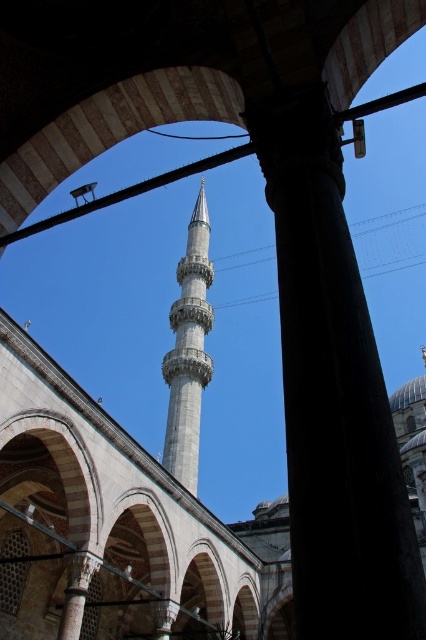
You are standing inside the mosque and want to take a photo of the smooth white minaret at center. To avoid blocking the minaret in your photo, which direction should you move relative to the smooth stone pillar at center?

You should move to the left relative to the smooth stone pillar at center because the smooth stone pillar at center is to the right of the smooth white minaret at center, so moving left would position you away from the pillar and keep the minaret unobstructed.

You are standing inside the mosque and looking up at the minaret. There are two points marked in the image. The first point is at coordinates point (281, 198) and the second is at point (206, 380). Which of these two points is closer to you?

Point (281, 198) is in front of point (206, 380), so it is closer to you.

You are standing inside the mosque and looking up. You see the smooth stone pillar at center and the smooth white minaret at center. Which one is closer to the ceiling?

The smooth white minaret at center is closer to the ceiling because the smooth stone pillar at center is below it.